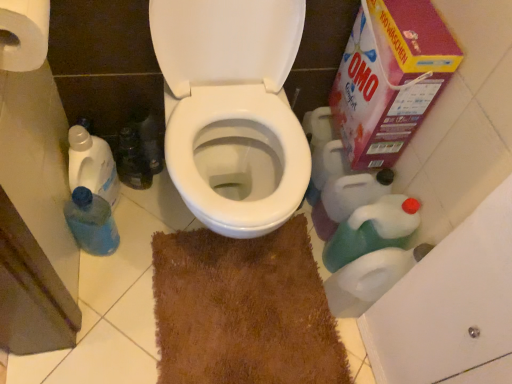
Question: Considering the relative sizes of white paper towel at upper left and brown shaggy rug at center in the image provided, is white paper towel at upper left taller than brown shaggy rug at center?

Choices:
 (A) yes
 (B) no

Answer: (A)

Question: Does white paper towel at upper left have a lesser width compared to brown shaggy rug at center?

Choices:
 (A) no
 (B) yes

Answer: (B)

Question: Would you say brown shaggy rug at center is part of white paper towel at upper left's contents?

Choices:
 (A) no
 (B) yes

Answer: (A)

Question: From the image's perspective, is white paper towel at upper left on top of brown shaggy rug at center?

Choices:
 (A) yes
 (B) no

Answer: (A)

Question: Is white paper towel at upper left oriented towards brown shaggy rug at center?

Choices:
 (A) yes
 (B) no

Answer: (B)

Question: Is white paper towel at upper left far from brown shaggy rug at center?

Choices:
 (A) yes
 (B) no

Answer: (B)

Question: Are cardboard box at upper right and brown shaggy rug at center far apart?

Choices:
 (A) no
 (B) yes

Answer: (A)

Question: Considering the relative positions of cardboard box at upper right and brown shaggy rug at center in the image provided, is cardboard box at upper right to the right of brown shaggy rug at center from the viewer's perspective?

Choices:
 (A) no
 (B) yes

Answer: (B)

Question: Is cardboard box at upper right at the left side of brown shaggy rug at center?

Choices:
 (A) yes
 (B) no

Answer: (B)

Question: Is cardboard box at upper right outside brown shaggy rug at center?

Choices:
 (A) yes
 (B) no

Answer: (A)

Question: Is cardboard box at upper right wider than brown shaggy rug at center?

Choices:
 (A) no
 (B) yes

Answer: (A)

Question: Is cardboard box at upper right thinner than brown shaggy rug at center?

Choices:
 (A) yes
 (B) no

Answer: (A)

Question: Is cardboard box at upper right shorter than blue plastic bottle at left, the first cleaning product from the left?

Choices:
 (A) yes
 (B) no

Answer: (B)